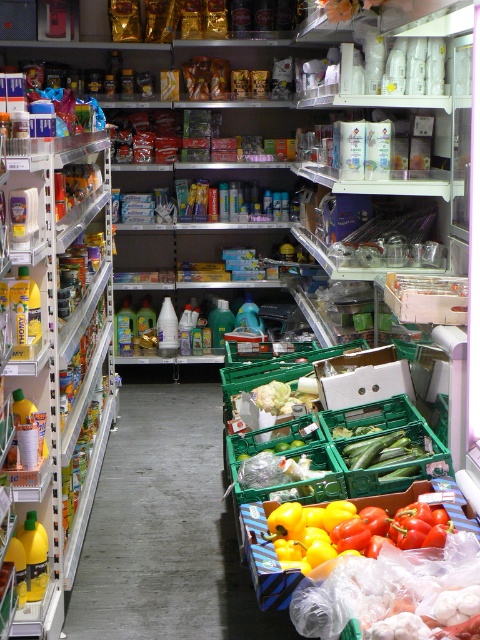
Consider the image. You are a customer in the grocery store and want to grab both the green plastic crate at center and the yellow matte bell pepper at center. Which one should you reach for first if you want to pick up the item that is to the left?

The green plastic crate at center is positioned on the left side of the yellow matte bell pepper at center, so you should reach for the green plastic crate at center first.

Consider the image. You are a delivery person who needs to place a package that is 1.5 meters long on the floor between the green plastic crate at center and the yellow matte bell pepper at center. Is there enough space?

The distance between the green plastic crate at center and the yellow matte bell pepper at center is 1.29 meters, which is shorter than the 1.5 meter package. Therefore, there is not enough space to place the package between them.